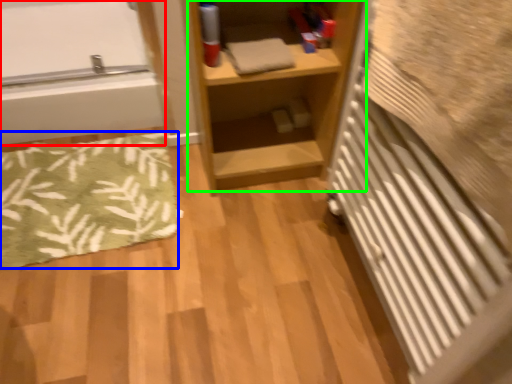
Question: Based on their relative distances, which object is nearer to bathtub (highlighted by a red box)? Choose from bath mat (highlighted by a blue box) and shelf (highlighted by a green box).

Choices:
 (A) bath mat
 (B) shelf

Answer: (A)